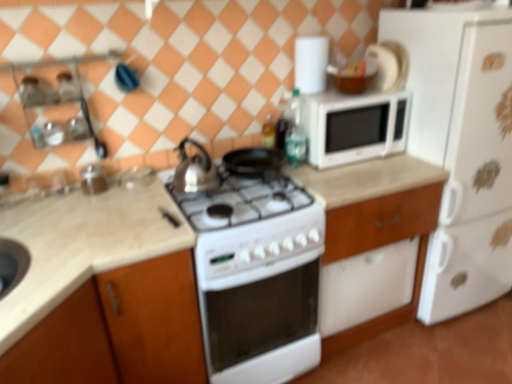
Where is `free space in front of transparent glass jar at upper left, the 1th appliance when ordered from left to right`? free space in front of transparent glass jar at upper left, the 1th appliance when ordered from left to right is located at coordinates (94, 202).